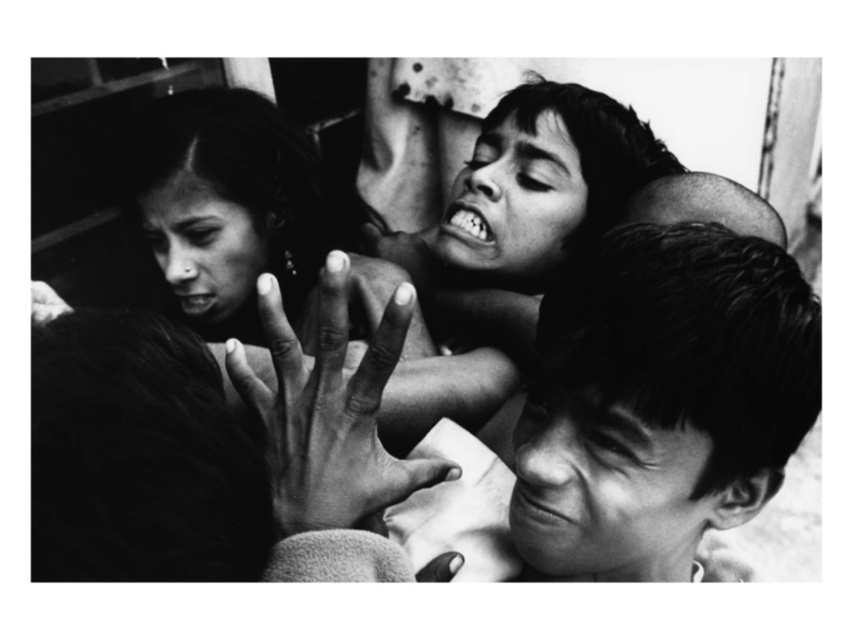
You are a photographer holding a camera that requires a minimum distance of 24 inches to focus properly. You are taking a photo of the scene and notice a point labeled as point (225,352) in the image. Will your camera be able to focus on this point?

The distance of point (225,352) from the viewer is 26.11 inches, which is greater than the minimum required 24 inches. Therefore, the camera should be able to focus on this point.